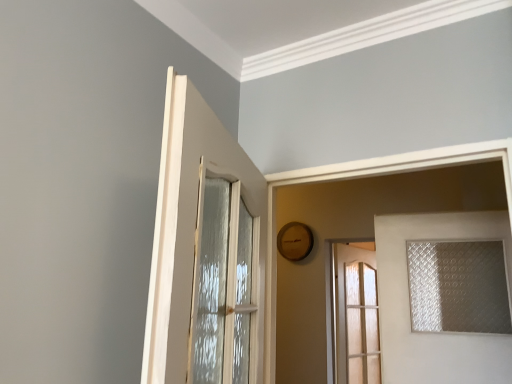
Question: Is the depth of clear glass door at right, the 2th door in the front-to-back sequence, less than that of white glossy door at upper left, the first door when ordered from left to right?

Choices:
 (A) yes
 (B) no

Answer: (B)

Question: From the image's perspective, does clear glass door at right, the 2th door in the front-to-back sequence, appear higher than white glossy door at upper left, which is the 3th door from right to left?

Choices:
 (A) yes
 (B) no

Answer: (B)

Question: Is clear glass door at right, the 1th door from the right, not close to white glossy door at upper left, which is the 3th door from right to left?

Choices:
 (A) yes
 (B) no

Answer: (A)

Question: Is white glossy door at upper left, placed as the third door when sorted from back to front, surrounded by clear glass door at right, the third door in the left-to-right sequence?

Choices:
 (A) no
 (B) yes

Answer: (A)

Question: Is clear glass door at right, the second door viewed from the back, turned away from white glossy door at upper left, which is counted as the first door, starting from the front?

Choices:
 (A) no
 (B) yes

Answer: (A)

Question: Is point (157, 379) positioned closer to the camera than point (353, 332)?

Choices:
 (A) closer
 (B) farther

Answer: (A)

Question: In the image, is white glossy door at upper left, the first door when ordered from left to right, on the left side or the right side of translucent glass door at center, acting as the second door starting from the right?

Choices:
 (A) right
 (B) left

Answer: (B)

Question: Considering the positions of white glossy door at upper left, the first door when ordered from left to right, and translucent glass door at center, the third door when ordered from front to back, in the image, is white glossy door at upper left, the first door when ordered from left to right, wider or thinner than translucent glass door at center, the third door when ordered from front to back,?

Choices:
 (A) thin
 (B) wide

Answer: (B)

Question: Relative to translucent glass door at center, the third door when ordered from front to back, is white glossy door at upper left, which is the 3th door from right to left, in front or behind?

Choices:
 (A) behind
 (B) front

Answer: (B)

Question: In terms of size, does translucent frosted glass window at right appear bigger or smaller than clear glass door at right, the second door viewed from the back?

Choices:
 (A) small
 (B) big

Answer: (A)

Question: Is point (457, 284) positioned closer to the camera than point (470, 334)?

Choices:
 (A) closer
 (B) farther

Answer: (B)

Question: Considering the positions of translucent frosted glass window at right and clear glass door at right, the 2th door in the front-to-back sequence, in the image, is translucent frosted glass window at right wider or thinner than clear glass door at right, the 2th door in the front-to-back sequence,?

Choices:
 (A) wide
 (B) thin

Answer: (A)

Question: Which is correct: translucent frosted glass window at right is inside clear glass door at right, the 1th door from the right, or outside of it?

Choices:
 (A) inside
 (B) outside

Answer: (B)

Question: Looking at the image, does clear glass door at right, the third door in the left-to-right sequence, seem bigger or smaller compared to translucent glass door at center, the third door when ordered from front to back?

Choices:
 (A) big
 (B) small

Answer: (B)

Question: From a real-world perspective, relative to translucent glass door at center, acting as the second door starting from the right, is clear glass door at right, the second door viewed from the back, vertically above or below?

Choices:
 (A) below
 (B) above

Answer: (B)